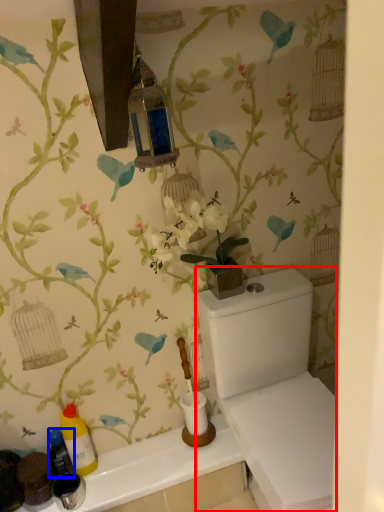
Question: Which object appears closest to the camera in this image, porcelain (highlighted by a red box) or bottle (highlighted by a blue box)?

Choices:
 (A) porcelain
 (B) bottle

Answer: (A)